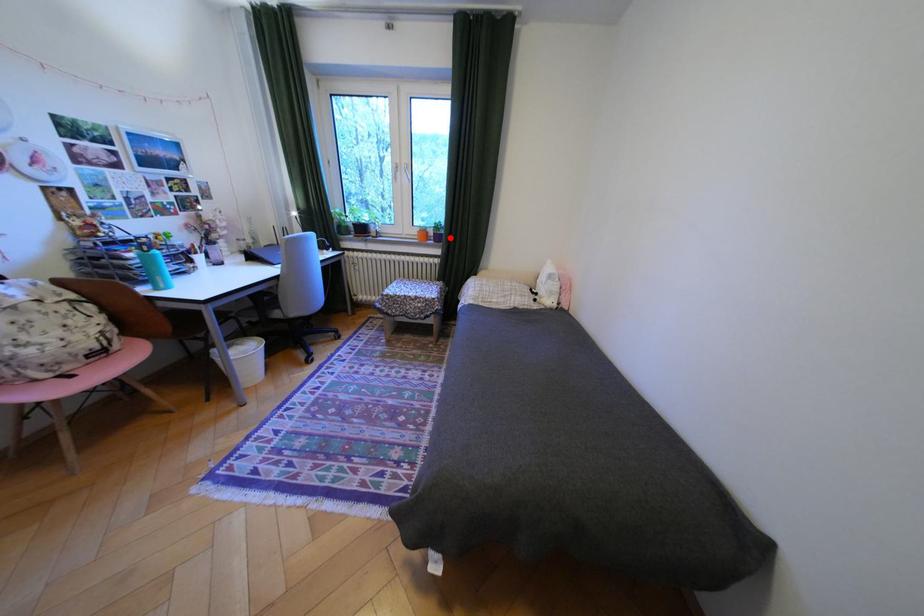
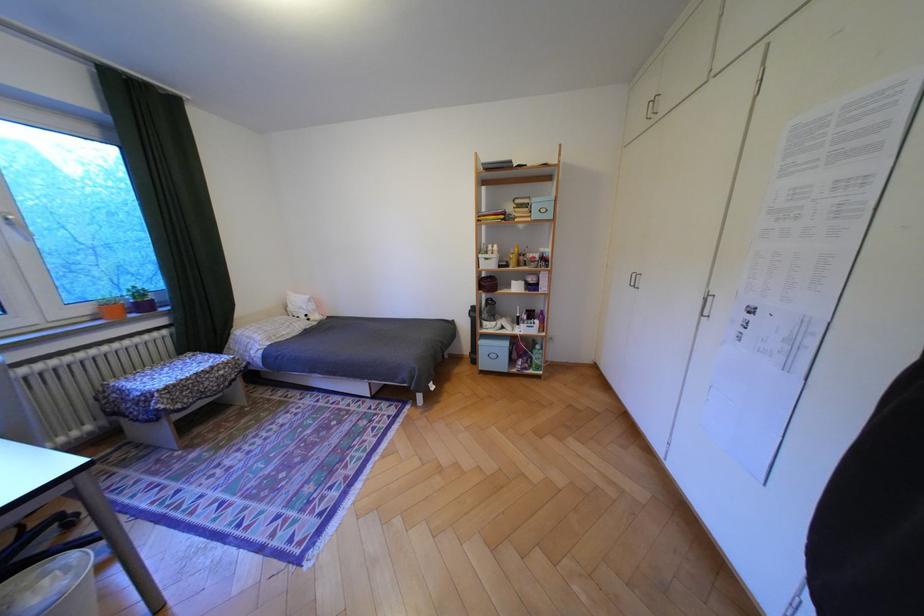
In the second image, find the point that corresponds to the highlighted location in the first image.

(155, 307)